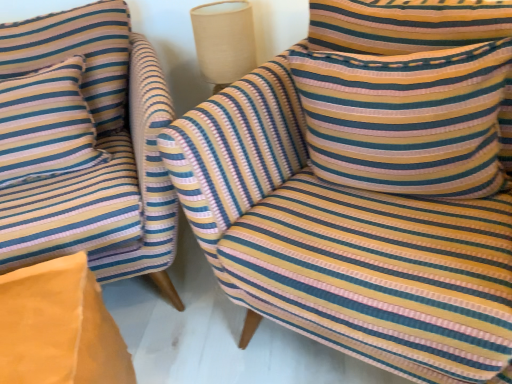
Question: From the image's perspective, relative to beige fabric lampshade at upper center, is striped fabric chair at left, the first chair positioned from the left, above or below?

Choices:
 (A) above
 (B) below

Answer: (B)

Question: Is striped fabric chair at left, the first chair positioned from the left, taller or shorter than beige fabric lampshade at upper center?

Choices:
 (A) tall
 (B) short

Answer: (A)

Question: Which is nearer to the beige fabric lampshade at upper center?

Choices:
 (A) striped fabric chair at center, the second chair in the left-to-right sequence
 (B) striped fabric pillow at left, the first pillow viewed from the left
 (C) orange fabric cushion at lower left
 (D) striped fabric chair at left, which is the 2th chair from right to left
 (E) striped fabric pillow at upper right, marked as the first pillow in a right-to-left arrangement

Answer: (D)

Question: Considering the real-world distances, which object is farthest from the striped fabric pillow at left, which is counted as the 2th pillow, starting from the right?

Choices:
 (A) beige fabric lampshade at upper center
 (B) striped fabric pillow at upper right, the second pillow in the left-to-right sequence
 (C) striped fabric chair at left, which is the 2th chair from right to left
 (D) striped fabric chair at center, the second chair in the left-to-right sequence
 (E) orange fabric cushion at lower left

Answer: (B)